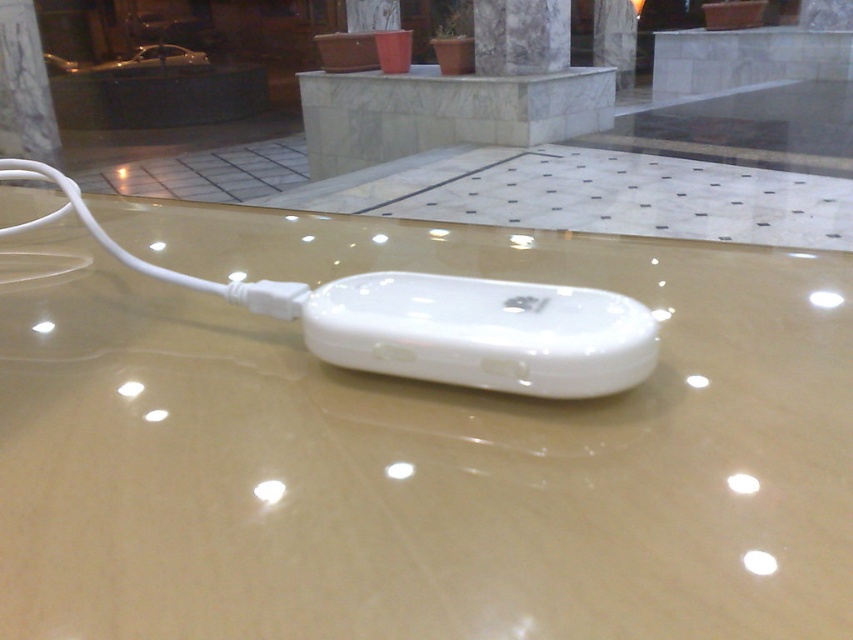
You are standing in the room and see the point marked at coordinate (x=482, y=332). What object is located at that point?

The point at (x=482, y=332) marks the white glossy iPod at center.

You are trying to place a small decorative item on the transparent glossy glass table at center. However, you notice the white glossy ipod at center is already occupying space there. Can the item be placed on the table without moving the iPod?

The transparent glossy glass table at center is taller than the white glossy ipod at center, so yes, the item can be placed on the table above the iPod as long as there is enough space.

Where is the transparent glossy glass table at center located in the image?

The transparent glossy glass table at center is located at point (x=413, y=448) in the image.